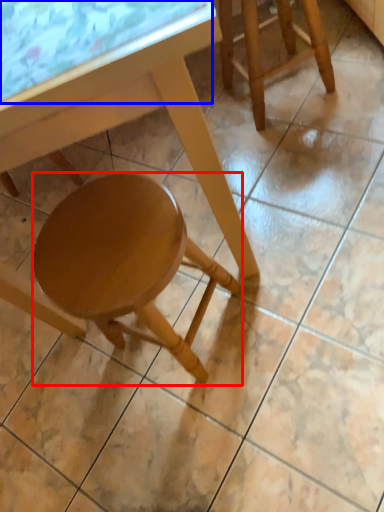
Question: Which object is further to the camera taking this photo, stool (highlighted by a red box) or glass table (highlighted by a blue box)?

Choices:
 (A) stool
 (B) glass table

Answer: (A)